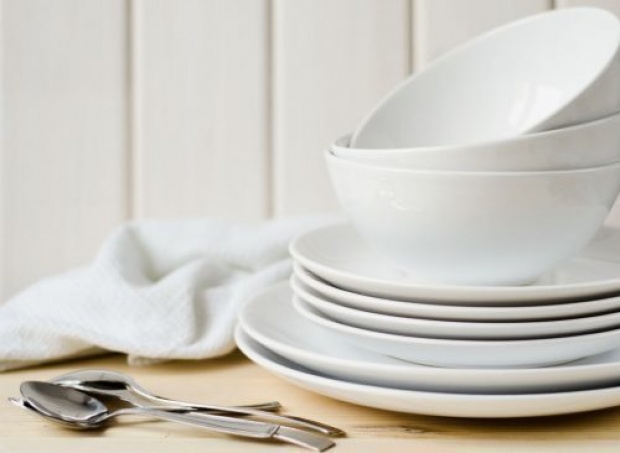
You are a GUI agent. You are given a task and a screenshot of the screen. Output one action in this format:
    pyautogui.click(x=<x>, y=<y>)
    Task: Click on the plates
    
    Given the screenshot: What is the action you would take?
    pyautogui.click(x=404, y=395), pyautogui.click(x=418, y=374), pyautogui.click(x=438, y=345), pyautogui.click(x=430, y=330), pyautogui.click(x=467, y=314), pyautogui.click(x=425, y=294)